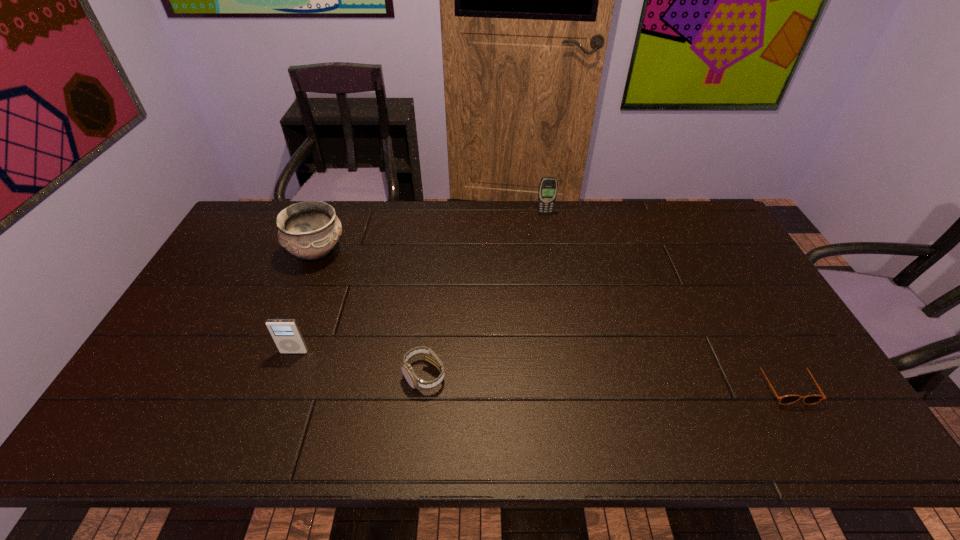
Where is `the farthest object`? the farthest object is located at coordinates (548, 186).

Locate an element on the screen. Image resolution: width=960 pixels, height=540 pixels. cellular telephone is located at coordinates (548, 186).

You are a GUI agent. You are given a task and a screenshot of the screen. Output one action in this format:
    pyautogui.click(x=<x>, y=<y>)
    Task: Click on the pottery
    The height and width of the screenshot is (540, 960).
    Given the screenshot: What is the action you would take?
    pyautogui.click(x=309, y=230)

This screenshot has width=960, height=540. I want to click on the third shortest object, so click(286, 334).

Find the location of a particular element. iPod is located at coordinates (286, 334).

Identify the location of watch. (414, 381).

Locate an element on the screen. The image size is (960, 540). the third object from right to left is located at coordinates (414, 381).

Identify the location of sunglasses. (787, 399).

Image resolution: width=960 pixels, height=540 pixels. Identify the location of the shortest object. (787, 399).

This screenshot has height=540, width=960. Find the location of `vacant area located 0.270m on the screen of the fourth object from left to right`. vacant area located 0.270m on the screen of the fourth object from left to right is located at coordinates (554, 265).